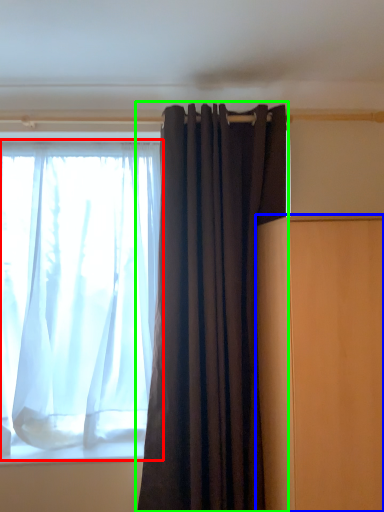
Question: Based on their relative distances, which object is nearer to curtain (highlighted by a red box)? Choose from furniture (highlighted by a blue box) and curtain (highlighted by a green box).

Choices:
 (A) furniture
 (B) curtain

Answer: (B)